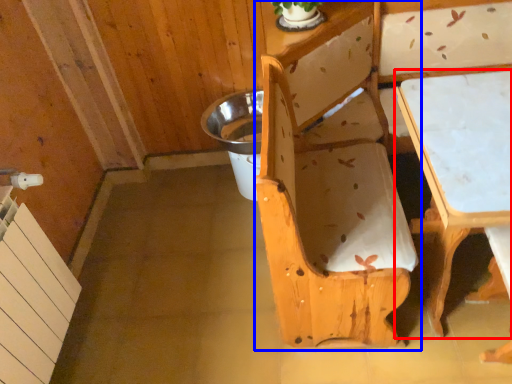
Question: Which point is further to the camera, table (highlighted by a red box) or chair (highlighted by a blue box)?

Choices:
 (A) table
 (B) chair

Answer: (A)